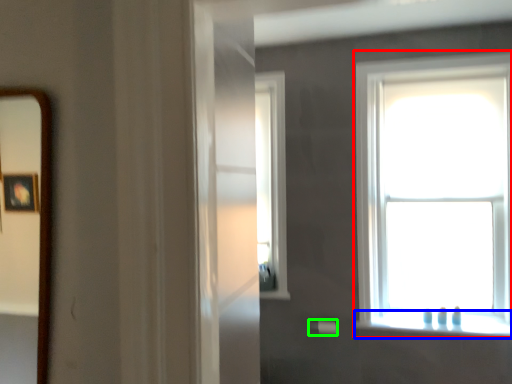
Question: Which object is the closest to the window (highlighted by a red box)? Choose among these: window sill (highlighted by a blue box) or towel bar (highlighted by a green box).

Choices:
 (A) window sill
 (B) towel bar

Answer: (A)